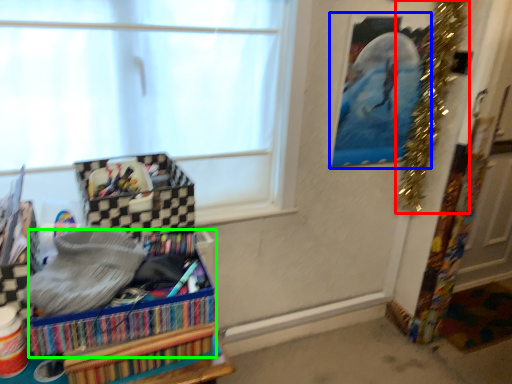
Question: Which object is the farthest from christmas decoration (highlighted by a red box)? Choose among these: picture frame (highlighted by a blue box) or storage box (highlighted by a green box).

Choices:
 (A) picture frame
 (B) storage box

Answer: (B)